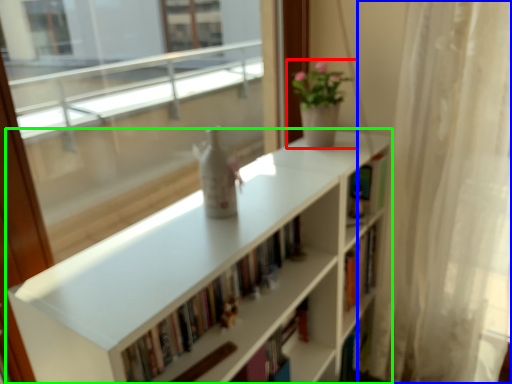
Question: Which is farther away from houseplant (highlighted by a red box)? curtain (highlighted by a blue box) or bookcase (highlighted by a green box)?

Choices:
 (A) curtain
 (B) bookcase

Answer: (A)